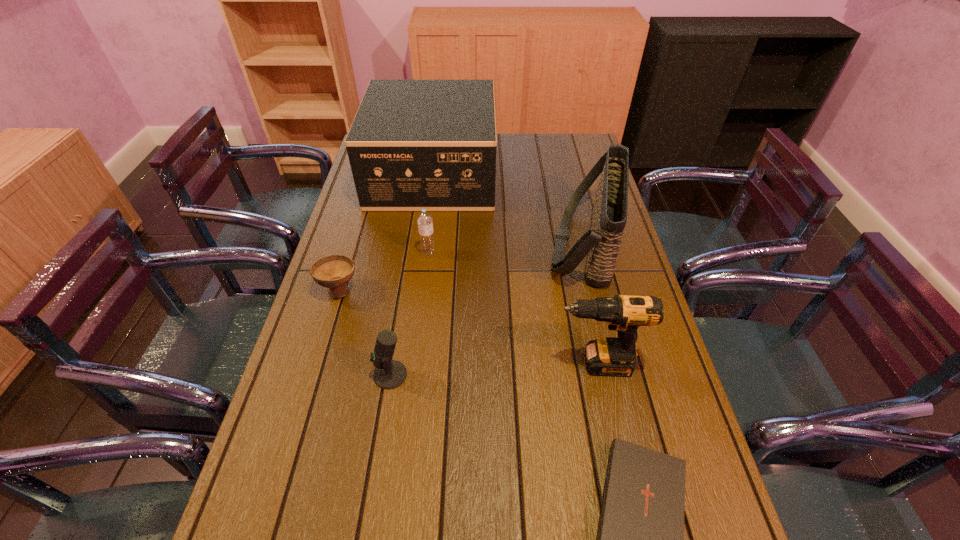
Where is `free space located at the tip of the drill`? free space located at the tip of the drill is located at coordinates (437, 364).

Locate an element on the screen. vacant space located 0.180m on the right of the water bottle is located at coordinates (493, 253).

At what (x,y) coordinates should I click in order to perform the action: click on blank space located 0.130m on the front of the microphone. Please return your answer as a coordinate pair (x, y). Looking at the image, I should click on (379, 443).

Identify the location of vacant region located on the right of the second shortest object. (489, 290).

Locate an element on the screen. This screenshot has width=960, height=540. object at the far edge is located at coordinates (414, 144).

The image size is (960, 540). In order to click on box located at the left edge in this screenshot , I will do `click(414, 144)`.

Identify the location of soup bowl located at the left edge. (334, 271).

You are a GUI agent. You are given a task and a screenshot of the screen. Output one action in this format:
    pyautogui.click(x=<x>, y=<y>)
    Task: Click on the handbag situated at the right edge
    
    Given the screenshot: What is the action you would take?
    pyautogui.click(x=601, y=243)

Identify the location of drill present at the right edge. The width and height of the screenshot is (960, 540). [612, 356].

Identify the location of object that is at the far left corner. Image resolution: width=960 pixels, height=540 pixels. (414, 144).